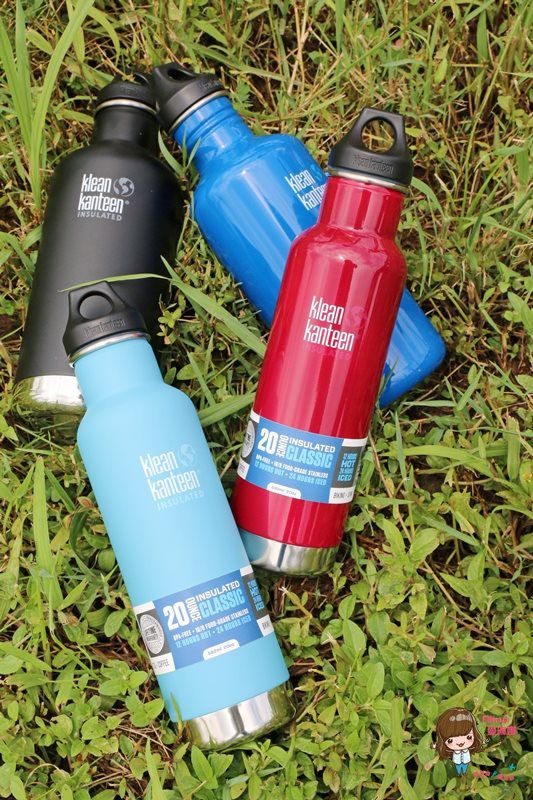
Find the location of a particular element. Image resolution: width=533 pixels, height=800 pixels. thermos is located at coordinates (169, 528), (314, 388), (254, 222), (101, 242).